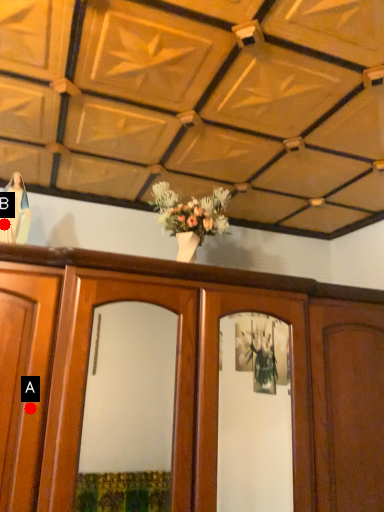
Question: Two points are circled on the image, labeled by A and B beside each circle. Which point appears farthest from the camera in this image?

Choices:
 (A) A is further
 (B) B is further

Answer: (B)